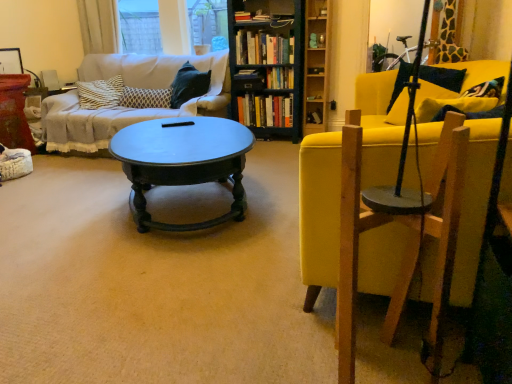
Question: From the image's perspective, is patterned fabric pillow at center-left on wooden swivel chair at right?

Choices:
 (A) no
 (B) yes

Answer: (B)

Question: From a real-world perspective, does patterned fabric pillow at center-left stand above wooden swivel chair at right?

Choices:
 (A) no
 (B) yes

Answer: (B)

Question: Is patterned fabric pillow at center-left at the left side of wooden swivel chair at right?

Choices:
 (A) yes
 (B) no

Answer: (A)

Question: Can you confirm if patterned fabric pillow at center-left is thinner than wooden swivel chair at right?

Choices:
 (A) no
 (B) yes

Answer: (B)

Question: Is the position of patterned fabric pillow at center-left more distant than that of wooden swivel chair at right?

Choices:
 (A) yes
 (B) no

Answer: (A)

Question: Relative to wooden swivel chair at right, is wooden bookshelf at center in front or behind?

Choices:
 (A) front
 (B) behind

Answer: (B)

Question: Would you say wooden bookshelf at center is inside or outside wooden swivel chair at right?

Choices:
 (A) inside
 (B) outside

Answer: (B)

Question: Based on their sizes in the image, would you say wooden bookshelf at center is bigger or smaller than wooden swivel chair at right?

Choices:
 (A) big
 (B) small

Answer: (A)

Question: Based on their positions, is wooden bookshelf at center located to the left or right of wooden swivel chair at right?

Choices:
 (A) right
 (B) left

Answer: (B)

Question: Looking at the image, does wooden bookshelf at center seem bigger or smaller compared to hardcover books at center, which is counted as the 6th book, starting from the bottom?

Choices:
 (A) big
 (B) small

Answer: (A)

Question: Relative to hardcover books at center, the first book from the top, is wooden bookshelf at center in front or behind?

Choices:
 (A) behind
 (B) front

Answer: (B)

Question: From the image's perspective, is wooden bookshelf at center above or below hardcover books at center, the first book from the top?

Choices:
 (A) above
 (B) below

Answer: (B)

Question: From a real-world perspective, is wooden bookshelf at center above or below hardcover books at center, the first book from the top?

Choices:
 (A) above
 (B) below

Answer: (B)

Question: From a real-world perspective, is wooden swivel chair at right physically located above or below wooden bookshelf at center?

Choices:
 (A) above
 (B) below

Answer: (B)

Question: Is wooden swivel chair at right wider or thinner than wooden bookshelf at center?

Choices:
 (A) thin
 (B) wide

Answer: (A)